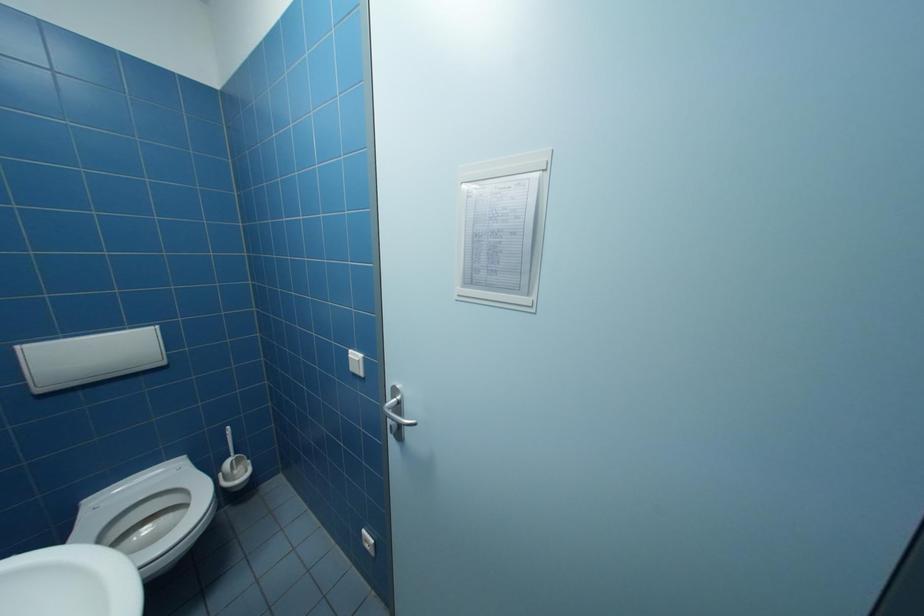
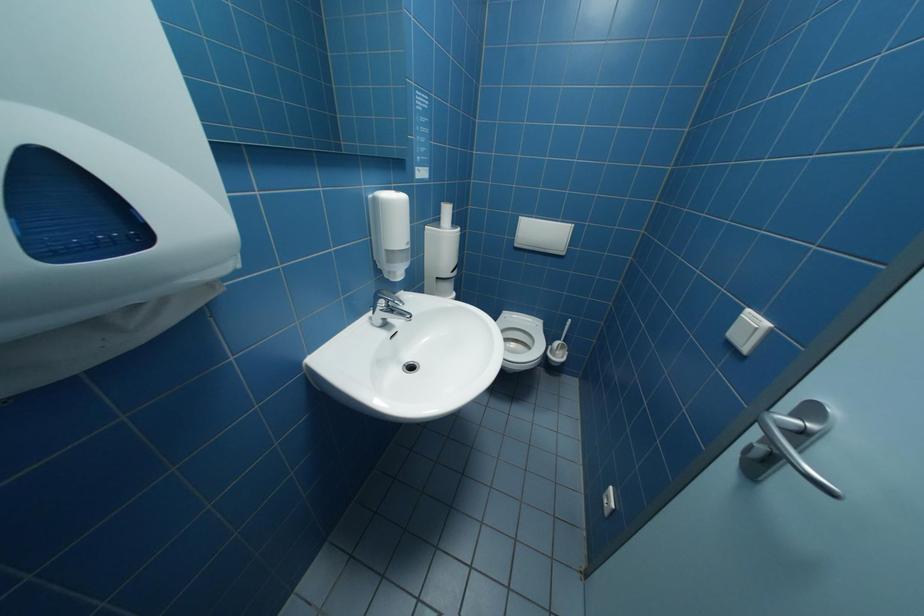
Based on the continuous images, in which direction is the camera rotating?

The camera rotated toward left-down.